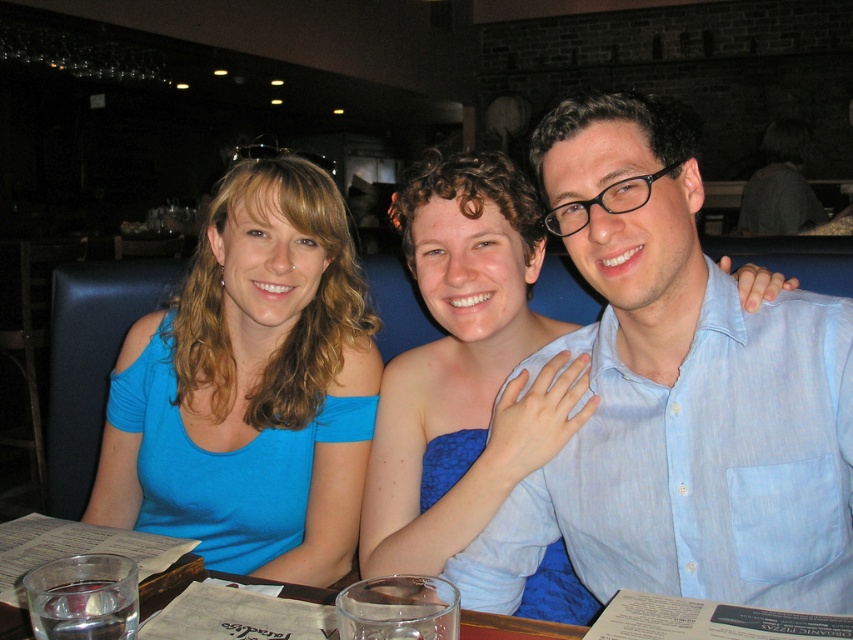
Question: Which point is farther from the camera taking this photo?

Choices:
 (A) 122,531
 (B) 271,161

Answer: (B)

Question: Is light blue shirt at center wider than clear glass water at lower center?

Choices:
 (A) no
 (B) yes

Answer: (A)

Question: Among these objects, which one is farthest from the camera?

Choices:
 (A) light blue shirt at center
 (B) clear glass water at lower center

Answer: (A)

Question: Among these points, which one is farthest from the camera?

Choices:
 (A) (756, 536)
 (B) (279, 170)
 (C) (77, 552)

Answer: (B)

Question: Is blue cotton shirt at left closer to the viewer compared to clear glass water at lower center?

Choices:
 (A) no
 (B) yes

Answer: (A)

Question: From the image, what is the correct spatial relationship of light blue shirt at center in relation to blue cotton shirt at left?

Choices:
 (A) left
 (B) right

Answer: (B)